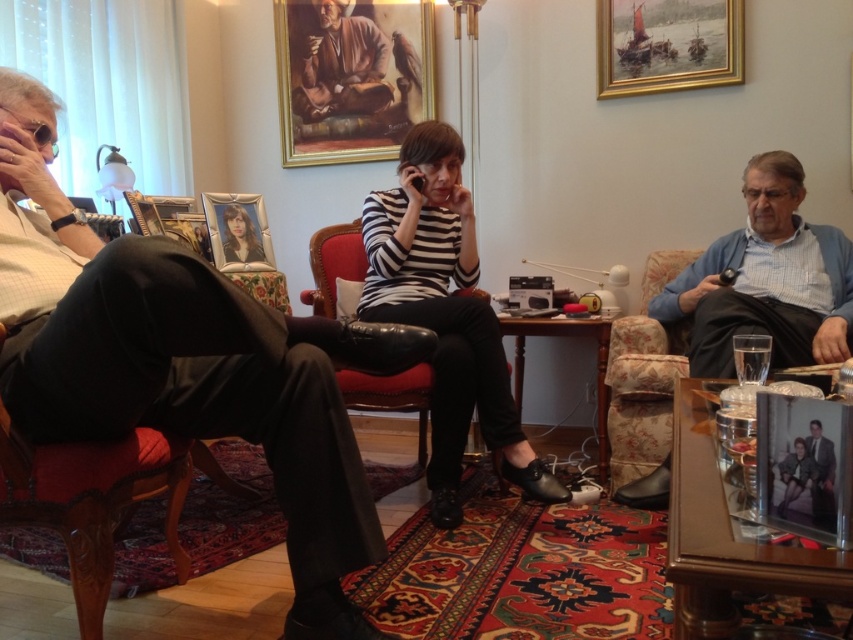
Question: Is striped fabric shirt at center closer to camera compared to gold-framed portrait at center?

Choices:
 (A) yes
 (B) no

Answer: (A)

Question: Can you confirm if blue cotton sweater at right is thinner than brown textured robe at upper center?

Choices:
 (A) yes
 (B) no

Answer: (B)

Question: Which point is closer to the camera?

Choices:
 (A) (x=314, y=506)
 (B) (x=216, y=221)
 (C) (x=440, y=289)

Answer: (A)

Question: Among these points, which one is farthest from the camera?

Choices:
 (A) (86, 392)
 (B) (215, 227)
 (C) (235, 211)
 (D) (285, 28)

Answer: (D)

Question: Observing the image, what is the correct spatial positioning of blue cotton sweater at right in reference to leather at center?

Choices:
 (A) right
 (B) left

Answer: (A)

Question: Which point is closer to the camera taking this photo?

Choices:
 (A) (425, 45)
 (B) (428, 378)

Answer: (B)